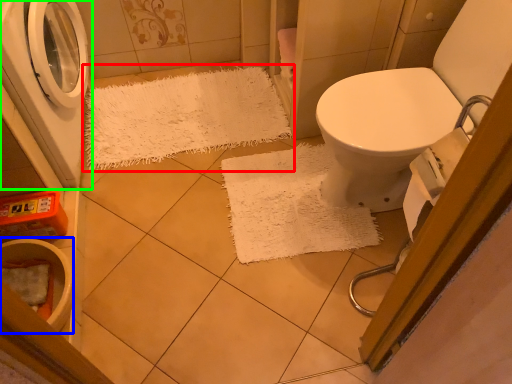
Question: Which is nearer to the doormat (highlighted by a red box)? toilet bowl (highlighted by a blue box) or washing machine (highlighted by a green box).

Choices:
 (A) toilet bowl
 (B) washing machine

Answer: (B)